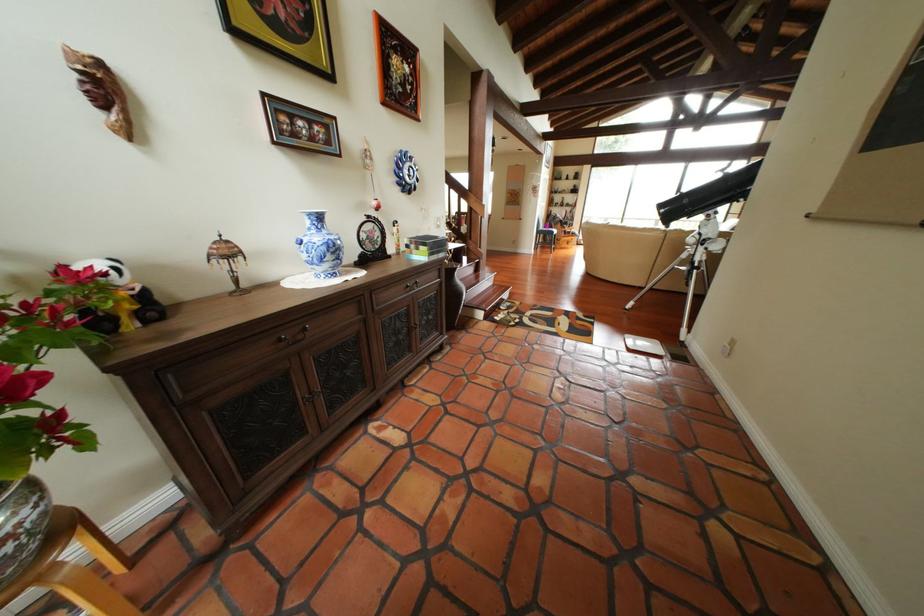
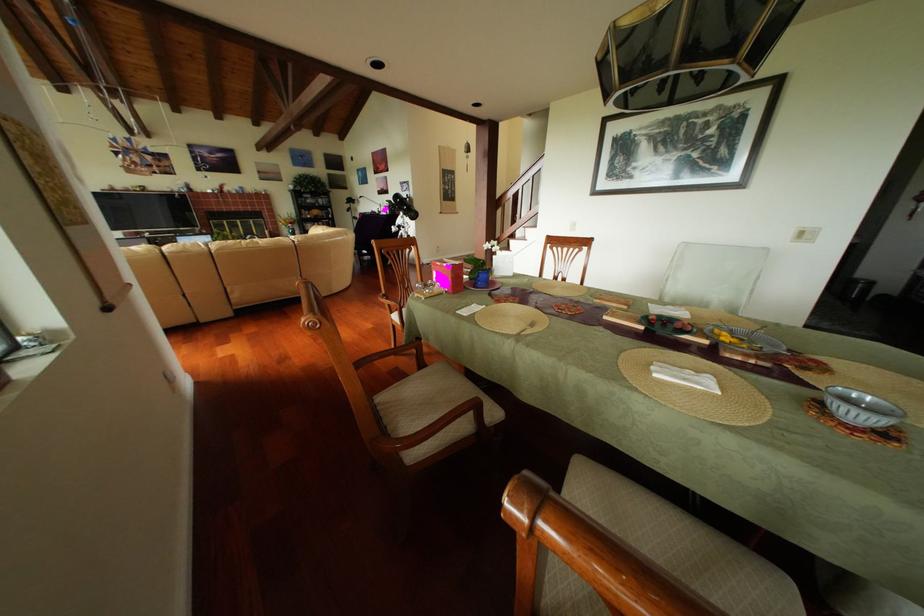
Question: I am providing you with two images of the same scene from different viewpoints. After the viewpoint changes to image2, which objects are now occluded?

Choices:
 (A) small decorative lamp
 (B) wooden chair armrest
 (C) metal faucet diverter
 (D) chair sitting surface

Answer: (A)